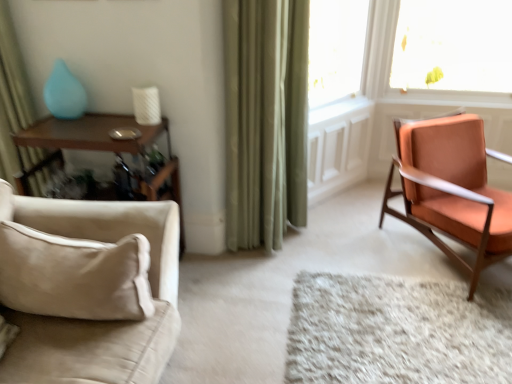
What are the coordinates of `vacant space underneath matte ceramic vase at upper left (from a real-world perspective)` in the screenshot? It's located at (75, 116).